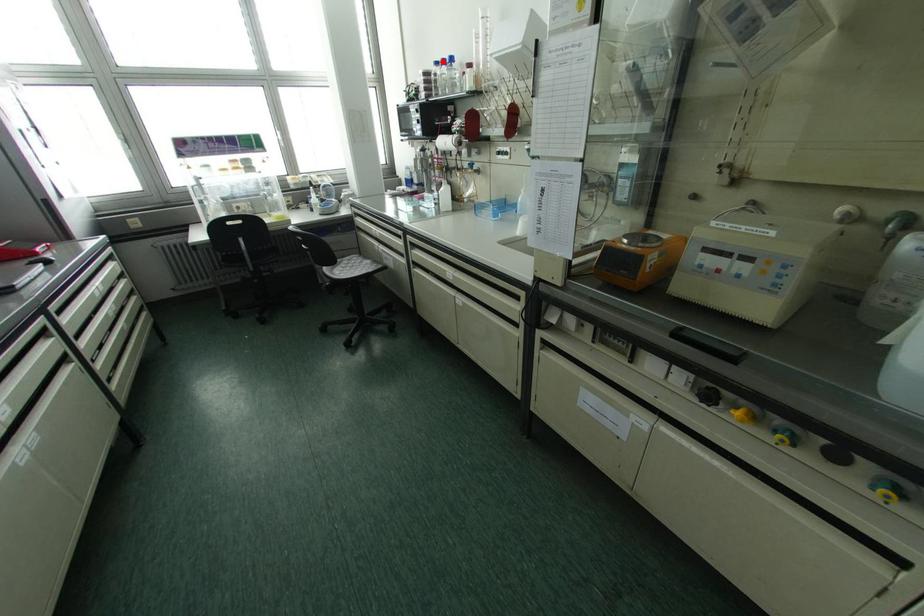
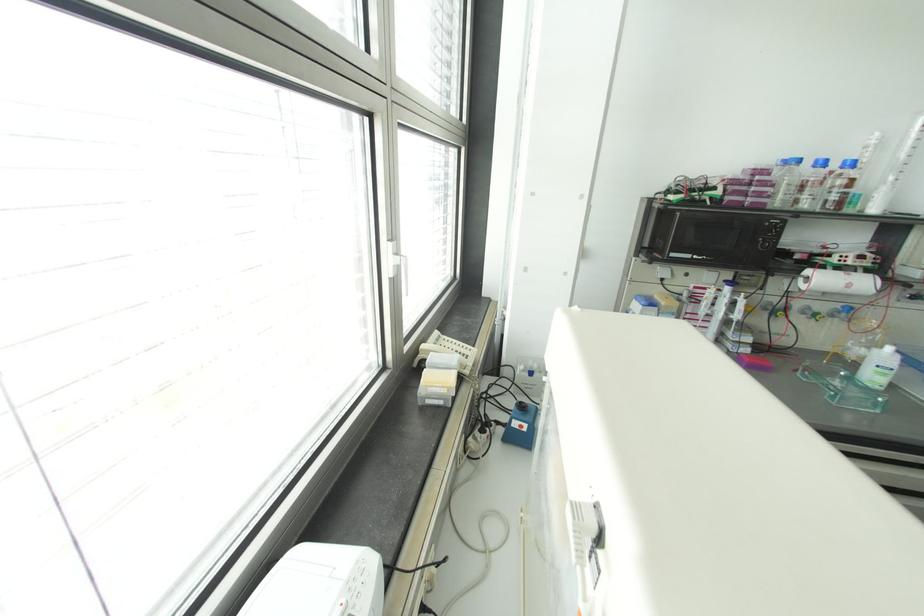
In the second image, find the point that corresponds to the highlighted location in the first image.

(822, 163)